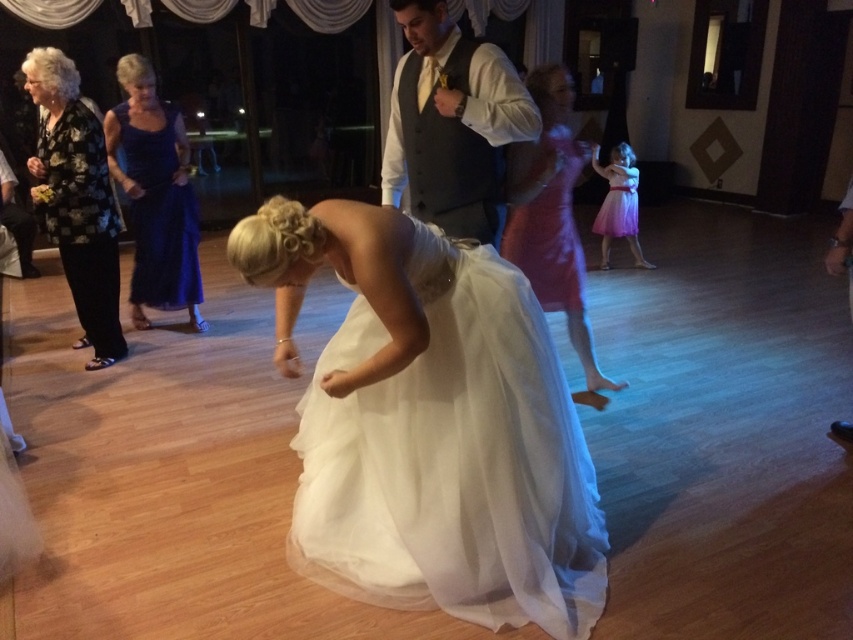
You are a photographer at a wedding reception and need to decide which item to focus on first between the matte gray vest at center and the matte pink tulle dress at center. Considering their sizes, which one should you prioritize?

The matte gray vest at center is bigger than the matte pink tulle dress at center, so you should prioritize focusing on the matte gray vest at center first because it occupies more space in the frame.

What is located at the coordinate point (x=77, y=200) in the image?

The black floral blouse at left is located at point (x=77, y=200).